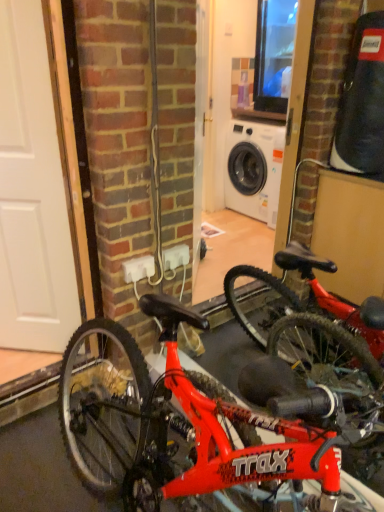
Question: Would you say white matte door at left is inside or outside white plastic electric outlet at center?

Choices:
 (A) inside
 (B) outside

Answer: (B)

Question: Considering their positions, is white matte door at left located in front of or behind white plastic electric outlet at center?

Choices:
 (A) front
 (B) behind

Answer: (A)

Question: Which is farther from the shiny red bicycle at center?

Choices:
 (A) white plastic electric outlet at center
 (B) white matte door at left

Answer: (B)

Question: Estimate the real-world distances between objects in this image. Which object is closer to the white matte door at left?

Choices:
 (A) white plastic electric outlet at center
 (B) shiny red bicycle at center

Answer: (A)